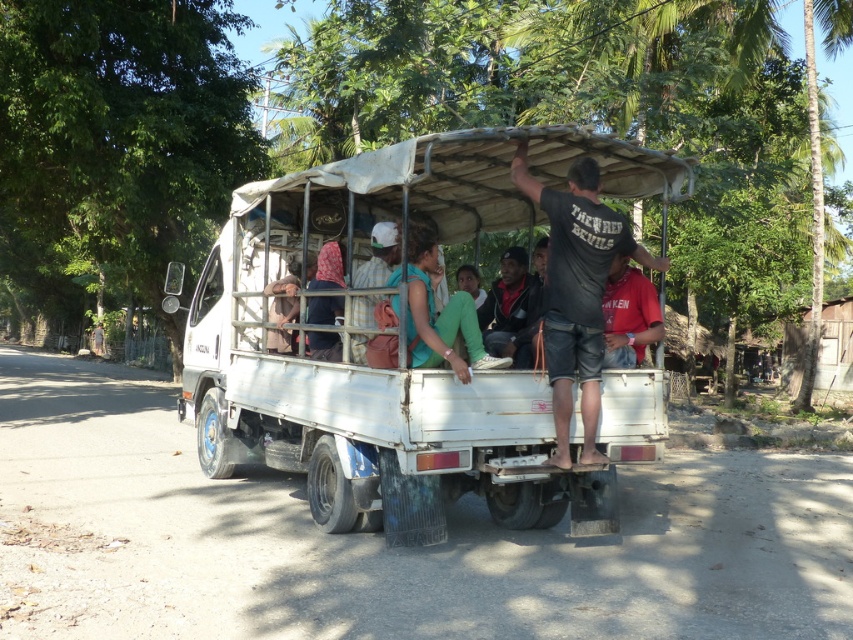
Question: Does black cotton shirt at center appear on the right side of dark gray fabric jacket at center?

Choices:
 (A) no
 (B) yes

Answer: (B)

Question: Is black cotton shirt at center positioned before matte red t-shirt at center?

Choices:
 (A) yes
 (B) no

Answer: (A)

Question: Which object is the closest to the dark gray fabric jacket at center?

Choices:
 (A) black cotton shirt at center
 (B) matte red t-shirt at center
 (C) white matte truck at center

Answer: (C)

Question: Which point is closer to the camera?

Choices:
 (A) white matte truck at center
 (B) dark gray fabric jacket at center
 (C) matte red t-shirt at center
 (D) black cotton shirt at center

Answer: (A)

Question: Is white matte truck at center bigger than black cotton shirt at center?

Choices:
 (A) yes
 (B) no

Answer: (A)

Question: Estimate the real-world distances between objects in this image. Which object is closer to the black cotton shirt at center?

Choices:
 (A) matte red t-shirt at center
 (B) dark gray fabric jacket at center

Answer: (A)